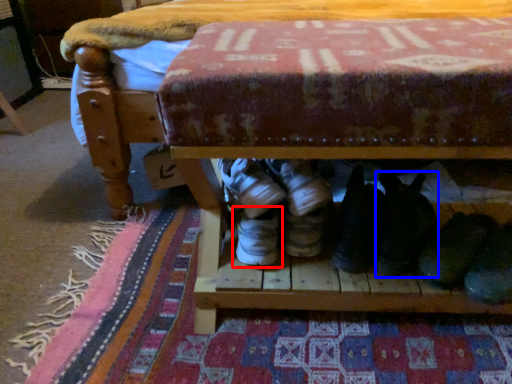
Question: Which object is further to the camera taking this photo, footwear (highlighted by a red box) or footwear (highlighted by a blue box)?

Choices:
 (A) footwear
 (B) footwear

Answer: (B)